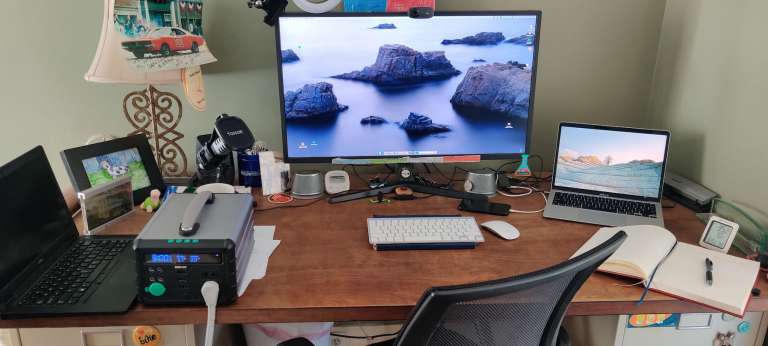
Locate an element on the screen. This screenshot has height=346, width=768. silver open laptop is located at coordinates (601, 199).